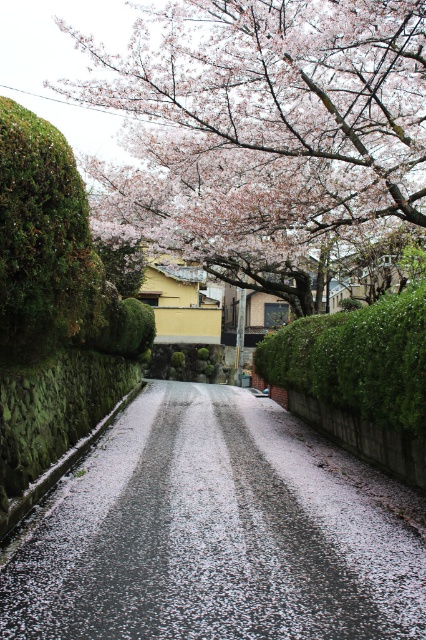
Question: Can you confirm if white textured road at center is positioned to the left of smooth pink blossoms at upper center?

Choices:
 (A) yes
 (B) no

Answer: (B)

Question: Which object appears farthest from the camera in this image?

Choices:
 (A) white textured road at center
 (B) smooth pink blossoms at upper center
 (C) green leafy hedge at center

Answer: (B)

Question: Among these objects, which one is farthest from the camera?

Choices:
 (A) white textured road at center
 (B) green leafy hedge at center
 (C) smooth pink blossoms at upper center

Answer: (C)

Question: Among these objects, which one is farthest from the camera?

Choices:
 (A) green leafy hedge at center
 (B) white textured road at center
 (C) smooth pink blossoms at upper center

Answer: (C)

Question: Can you confirm if white textured road at center is positioned below green leafy hedge at center?

Choices:
 (A) no
 (B) yes

Answer: (B)

Question: Does white textured road at center come behind green leafy hedge at center?

Choices:
 (A) no
 (B) yes

Answer: (A)